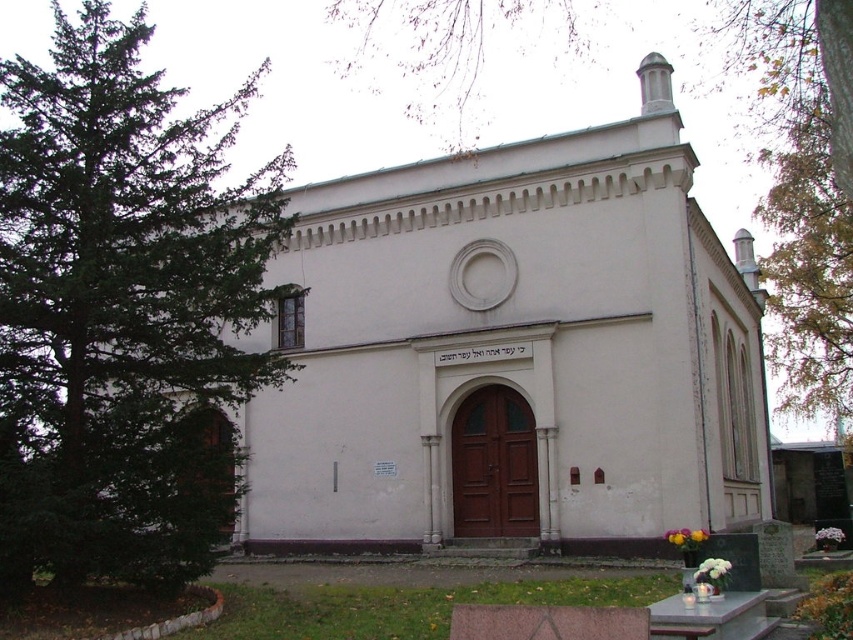
Question: Is white smooth church at center positioned in front of green evergreen tree at left?

Choices:
 (A) no
 (B) yes

Answer: (A)

Question: Which object is the closest to the white smooth church at center?

Choices:
 (A) green evergreen tree at left
 (B) green leafy tree at upper left

Answer: (A)

Question: Is white smooth church at center to the left of green leafy tree at upper left from the viewer's perspective?

Choices:
 (A) no
 (B) yes

Answer: (B)

Question: Which point is farther to the camera?

Choices:
 (A) white smooth church at center
 (B) green evergreen tree at left
 (C) green leafy tree at upper left

Answer: (A)

Question: Considering the real-world distances, which object is farthest from the green evergreen tree at left?

Choices:
 (A) white smooth church at center
 (B) green leafy tree at upper left

Answer: (B)

Question: Does green evergreen tree at left come in front of green leafy tree at upper left?

Choices:
 (A) no
 (B) yes

Answer: (B)